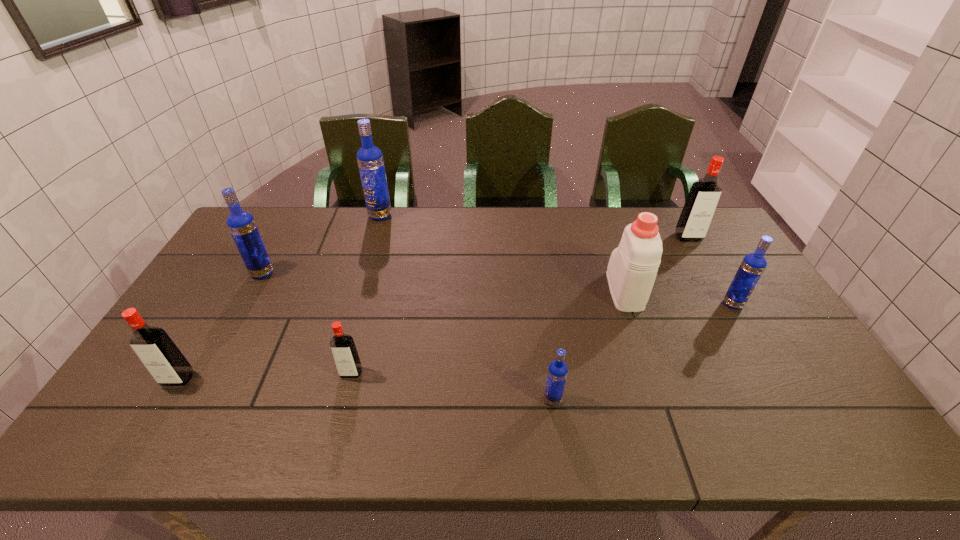
Where is `the second closest vodka to the nearest object`? The height and width of the screenshot is (540, 960). the second closest vodka to the nearest object is located at coordinates (753, 265).

Find the location of a particular element. The width and height of the screenshot is (960, 540). the seventh closest vodka to the white detergent is located at coordinates (168, 366).

Locate an element on the screen. The height and width of the screenshot is (540, 960). the second closest blue vodka to the tallest object is located at coordinates (557, 372).

Select which blue vodka is the third closest to the farthest red vodka. Please provide its 2D coordinates. Your answer should be formatted as a tuple, i.e. [(x, y)], where the tuple contains the x and y coordinates of a point satisfying the conditions above.

[(370, 160)]

Identify the location of the closest red vodka to the third blue vodka from right to left. (345, 355).

Identify which red vodka is located as the nearest to the fourth farthest vodka. Please provide its 2D coordinates. Your answer should be formatted as a tuple, i.e. [(x, y)], where the tuple contains the x and y coordinates of a point satisfying the conditions above.

[(699, 208)]